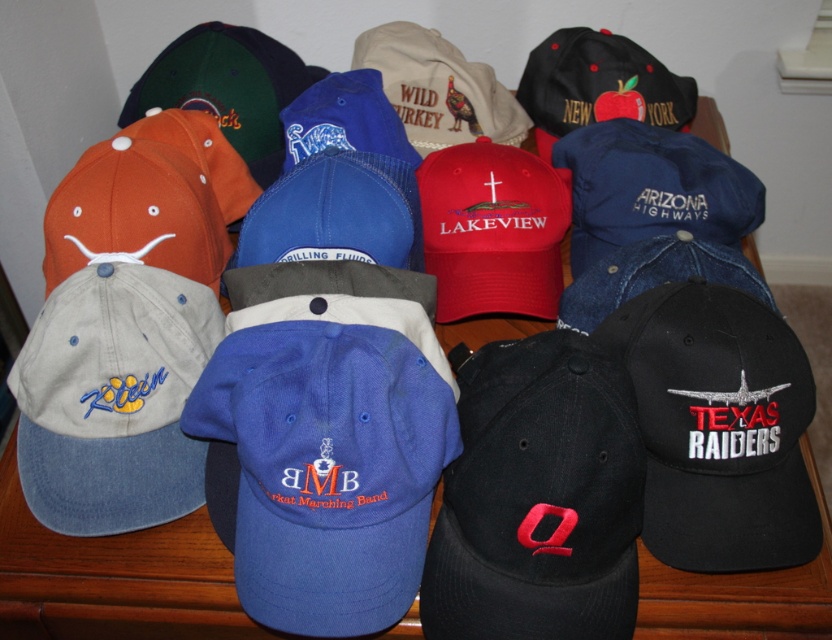
Question: Does gray denim baseball cap at left come in front of orange fabric baseball cap at left?

Choices:
 (A) yes
 (B) no

Answer: (A)

Question: Can you confirm if gray denim baseball cap at left is thinner than orange fabric baseball cap at left?

Choices:
 (A) yes
 (B) no

Answer: (A)

Question: Which point is farther to the camera?

Choices:
 (A) (78, 324)
 (B) (201, 204)

Answer: (B)

Question: Which point appears closest to the camera in this image?

Choices:
 (A) (112, 449)
 (B) (92, 192)

Answer: (A)

Question: Does gray denim baseball cap at left have a smaller size compared to orange fabric baseball cap at left?

Choices:
 (A) no
 (B) yes

Answer: (B)